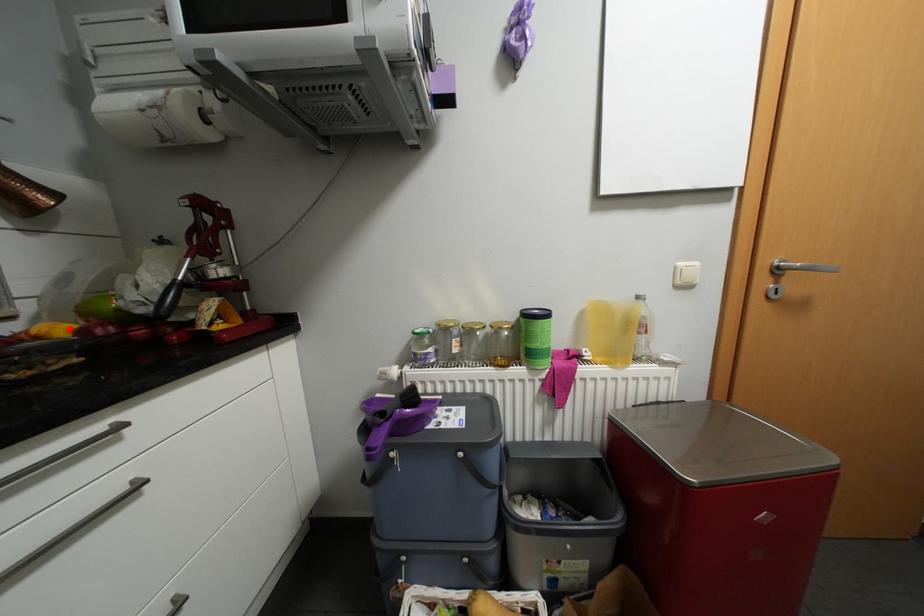
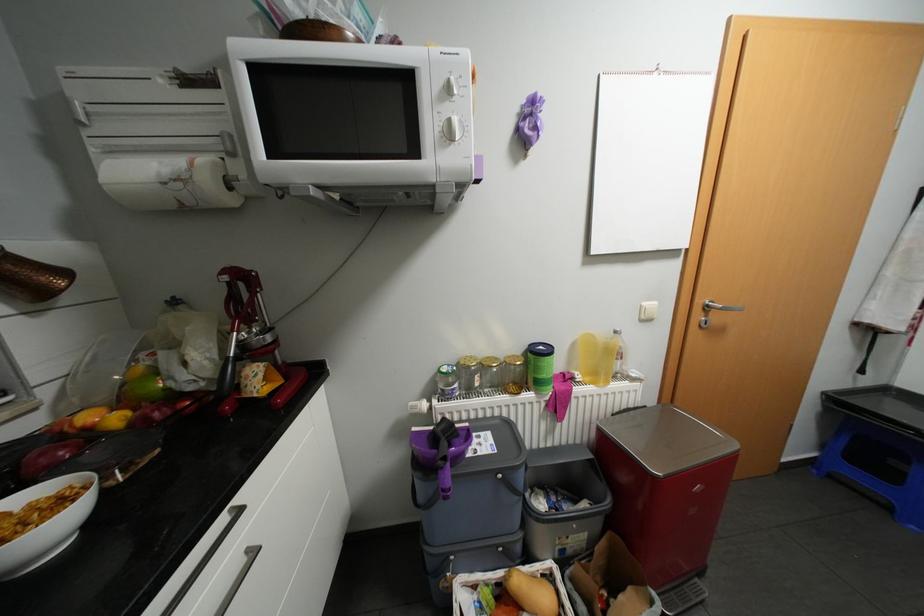
Find the pixel in the second image that matches the highlighted location in the first image.

(123, 418)